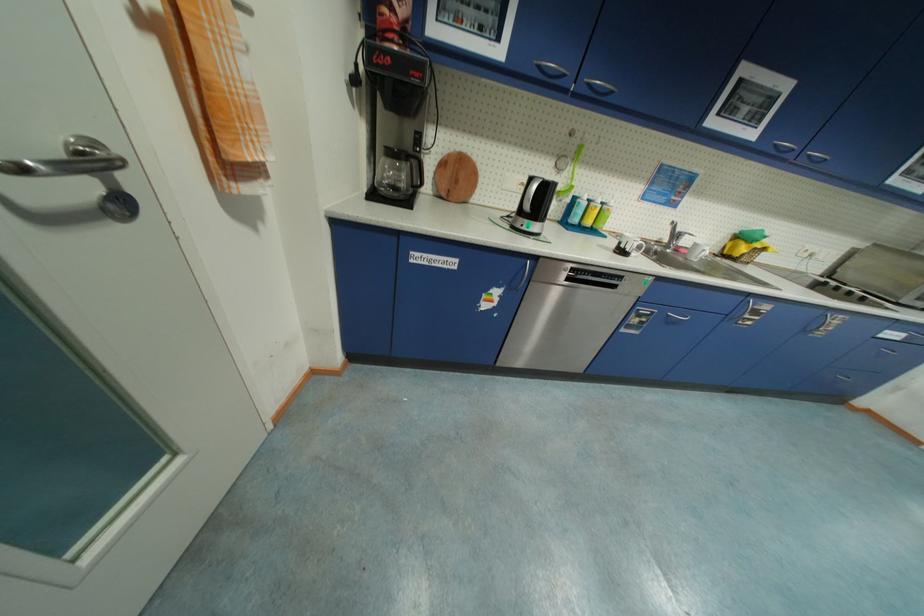
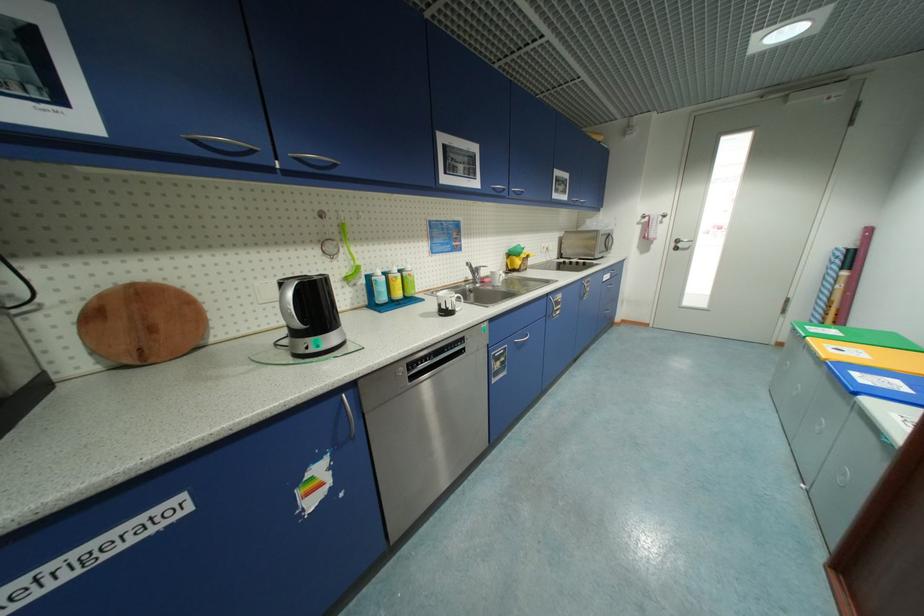
The point at [736,317] is marked in the first image. Where is the corresponding point in the second image?

(553, 315)